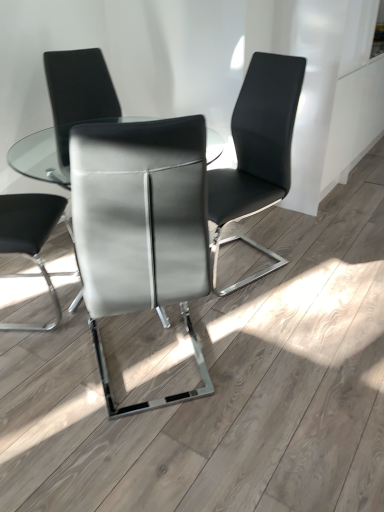
Identify the location of matte black chair at center, placed as the 3th chair when sorted from left to right. (257, 152).

The height and width of the screenshot is (512, 384). What do you see at coordinates (257, 152) in the screenshot?
I see `matte black chair at center, marked as the 1th chair in a right-to-left arrangement` at bounding box center [257, 152].

Identify the location of clear glass table at center. (40, 156).

Is satin gray leather chair at center, marked as the second chair in a right-to-left arrangement, touching matte black chair at center, placed as the 3th chair when sorted from left to right?

No, satin gray leather chair at center, marked as the second chair in a right-to-left arrangement, is not in contact with matte black chair at center, placed as the 3th chair when sorted from left to right.

How many degrees apart are the facing directions of satin gray leather chair at center, marked as the second chair in a right-to-left arrangement, and matte black chair at center, placed as the 3th chair when sorted from left to right?

The angle between the facing direction of satin gray leather chair at center, marked as the second chair in a right-to-left arrangement, and the facing direction of matte black chair at center, placed as the 3th chair when sorted from left to right, is 113 degrees.

Considering the sizes of objects satin gray leather chair at center, marked as the second chair in a right-to-left arrangement, and matte black chair at center, marked as the 1th chair in a right-to-left arrangement, in the image provided, who is wider, satin gray leather chair at center, marked as the second chair in a right-to-left arrangement, or matte black chair at center, marked as the 1th chair in a right-to-left arrangement,?

satin gray leather chair at center, marked as the second chair in a right-to-left arrangement.

Who is more distant, satin gray leather chair at center, placed as the 2th chair when sorted from left to right, or matte black chair at center, marked as the 1th chair in a right-to-left arrangement?

matte black chair at center, marked as the 1th chair in a right-to-left arrangement.

Looking at this image, from a real-world perspective, is matte black chair at center, placed as the 3th chair when sorted from left to right, positioned above or below satin gray leather chair at center, placed as the 2th chair when sorted from left to right?

In terms of real-world spatial position, matte black chair at center, placed as the 3th chair when sorted from left to right, is below satin gray leather chair at center, placed as the 2th chair when sorted from left to right.

From the image's perspective, which is below, matte black chair at center, marked as the 1th chair in a right-to-left arrangement, or satin gray leather chair at center, placed as the 2th chair when sorted from left to right?

satin gray leather chair at center, placed as the 2th chair when sorted from left to right, from the image's perspective.

Find the location of `chair that is below the matte black chair at center, placed as the 3th chair when sorted from left to right (from the image's perspective)`. chair that is below the matte black chair at center, placed as the 3th chair when sorted from left to right (from the image's perspective) is located at coordinates (141, 226).

Is satin gray leather chair at center, placed as the 2th chair when sorted from left to right, at the back of matte black chair at center, placed as the 3th chair when sorted from left to right?

matte black chair at center, placed as the 3th chair when sorted from left to right, is not turned away from satin gray leather chair at center, placed as the 2th chair when sorted from left to right.

The height and width of the screenshot is (512, 384). What are the coordinates of `table in front of the sleek leather chair at center, which is the third chair from right to left` in the screenshot? It's located at (40, 156).

Is sleek leather chair at center, which is the third chair from right to left, positioned in front of clear glass table at center?

No, sleek leather chair at center, which is the third chair from right to left, is further to the viewer.

Based on the photo, from their relative heights in the image, would you say sleek leather chair at center, placed as the first chair when sorted from left to right, is taller or shorter than clear glass table at center?

Considering their sizes, sleek leather chair at center, placed as the first chair when sorted from left to right, has more height than clear glass table at center.

From the picture: Is satin gray leather chair at center, placed as the 2th chair when sorted from left to right, to the left or to the right of sleek leather chair at center, which is the third chair from right to left, in the image?

Based on their positions, satin gray leather chair at center, placed as the 2th chair when sorted from left to right, is located to the right of sleek leather chair at center, which is the third chair from right to left.

Would you say satin gray leather chair at center, marked as the second chair in a right-to-left arrangement, is a long distance from sleek leather chair at center, placed as the first chair when sorted from left to right?

satin gray leather chair at center, marked as the second chair in a right-to-left arrangement, is positioned a significant distance from sleek leather chair at center, placed as the first chair when sorted from left to right.

Do you think satin gray leather chair at center, marked as the second chair in a right-to-left arrangement, is within sleek leather chair at center, placed as the first chair when sorted from left to right, or outside of it?

satin gray leather chair at center, marked as the second chair in a right-to-left arrangement, is not inside sleek leather chair at center, placed as the first chair when sorted from left to right, it's outside.

Considering the relative sizes of clear glass table at center and sleek leather chair at center, placed as the first chair when sorted from left to right, in the image provided, is clear glass table at center taller than sleek leather chair at center, placed as the first chair when sorted from left to right,?

Incorrect, the height of clear glass table at center is not larger of that of sleek leather chair at center, placed as the first chair when sorted from left to right.

From the image's perspective, is clear glass table at center under sleek leather chair at center, which is the third chair from right to left?

Yes.

Does clear glass table at center appear on the right side of sleek leather chair at center, which is the third chair from right to left?

Yes, clear glass table at center is to the right of sleek leather chair at center, which is the third chair from right to left.

Is clear glass table at center looking in the opposite direction of sleek leather chair at center, placed as the first chair when sorted from left to right?

Yes, sleek leather chair at center, placed as the first chair when sorted from left to right, is at the back of clear glass table at center.

Is matte black chair at center, marked as the 1th chair in a right-to-left arrangement, next to sleek leather chair at center, which is the third chair from right to left, and touching it?

matte black chair at center, marked as the 1th chair in a right-to-left arrangement, is not next to sleek leather chair at center, which is the third chair from right to left, and they're not touching.

Consider the image. From the image's perspective, which one is positioned lower, matte black chair at center, placed as the 3th chair when sorted from left to right, or sleek leather chair at center, placed as the first chair when sorted from left to right?

matte black chair at center, placed as the 3th chair when sorted from left to right.

From a real-world perspective, which object rests below the other?

In real-world perspective, matte black chair at center, placed as the 3th chair when sorted from left to right, is lower.

Who is smaller, matte black chair at center, placed as the 3th chair when sorted from left to right, or sleek leather chair at center, placed as the first chair when sorted from left to right?

sleek leather chair at center, placed as the first chair when sorted from left to right, is smaller.

From the image's perspective, relative to satin gray leather chair at center, marked as the second chair in a right-to-left arrangement, is clear glass table at center above or below?

From the image's perspective, clear glass table at center appears above satin gray leather chair at center, marked as the second chair in a right-to-left arrangement.

Is clear glass table at center next to satin gray leather chair at center, marked as the second chair in a right-to-left arrangement?

No, clear glass table at center is not with satin gray leather chair at center, marked as the second chair in a right-to-left arrangement.

Considering the points (61, 176) and (131, 172), which point is in front, point (61, 176) or point (131, 172)?

The point (131, 172) is in front.

Which object is wider, clear glass table at center or satin gray leather chair at center, placed as the 2th chair when sorted from left to right?

With larger width is clear glass table at center.

Where is `chair that is on the right side of satin gray leather chair at center, placed as the 2th chair when sorted from left to right`? The height and width of the screenshot is (512, 384). chair that is on the right side of satin gray leather chair at center, placed as the 2th chair when sorted from left to right is located at coordinates (257, 152).

This screenshot has height=512, width=384. What are the coordinates of `chair beneath the satin gray leather chair at center, placed as the 2th chair when sorted from left to right (from a real-world perspective)` in the screenshot? It's located at (257, 152).

From the image, which object appears to be nearer to matte black chair at center, marked as the 1th chair in a right-to-left arrangement, satin gray leather chair at center, placed as the 2th chair when sorted from left to right, or clear glass table at center?

satin gray leather chair at center, placed as the 2th chair when sorted from left to right, is positioned closer to the anchor matte black chair at center, marked as the 1th chair in a right-to-left arrangement.

Based on their spatial positions, is satin gray leather chair at center, placed as the 2th chair when sorted from left to right, or matte black chair at center, marked as the 1th chair in a right-to-left arrangement, closer to sleek leather chair at center, which is the third chair from right to left?

Among the two, matte black chair at center, marked as the 1th chair in a right-to-left arrangement, is located nearer to sleek leather chair at center, which is the third chair from right to left.

Considering their positions, is matte black chair at center, placed as the 3th chair when sorted from left to right, positioned further to satin gray leather chair at center, placed as the 2th chair when sorted from left to right, than clear glass table at center?

clear glass table at center is positioned further to the anchor satin gray leather chair at center, placed as the 2th chair when sorted from left to right.

When comparing their distances from sleek leather chair at center, placed as the first chair when sorted from left to right, does clear glass table at center or satin gray leather chair at center, marked as the second chair in a right-to-left arrangement, seem closer?

Based on the image, clear glass table at center appears to be nearer to sleek leather chair at center, placed as the first chair when sorted from left to right.

From the image, which object appears to be nearer to clear glass table at center, sleek leather chair at center, which is the third chair from right to left, or satin gray leather chair at center, placed as the 2th chair when sorted from left to right?

sleek leather chair at center, which is the third chair from right to left, lies closer to clear glass table at center than the other object.

Which object lies further to the anchor point sleek leather chair at center, placed as the first chair when sorted from left to right, satin gray leather chair at center, placed as the 2th chair when sorted from left to right, or clear glass table at center?

Among the two, satin gray leather chair at center, placed as the 2th chair when sorted from left to right, is located further to sleek leather chair at center, placed as the first chair when sorted from left to right.

Considering their positions, is matte black chair at center, marked as the 1th chair in a right-to-left arrangement, positioned closer to clear glass table at center than sleek leather chair at center, placed as the first chair when sorted from left to right?

sleek leather chair at center, placed as the first chair when sorted from left to right, is positioned closer to the anchor clear glass table at center.

When comparing their distances from sleek leather chair at center, which is the third chair from right to left, does clear glass table at center or matte black chair at center, marked as the 1th chair in a right-to-left arrangement, seem further?

matte black chair at center, marked as the 1th chair in a right-to-left arrangement, lies further to sleek leather chair at center, which is the third chair from right to left, than the other object.

At what (x,y) coordinates should I click in order to perform the action: click on table situated between sleek leather chair at center, placed as the first chair when sorted from left to right, and matte black chair at center, marked as the 1th chair in a right-to-left arrangement, from left to right. Please return your answer as a coordinate pair (x, y). Looking at the image, I should click on point(40,156).

Locate an element on the screen. Image resolution: width=384 pixels, height=512 pixels. table between satin gray leather chair at center, placed as the 2th chair when sorted from left to right, and sleek leather chair at center, placed as the first chair when sorted from left to right, along the z-axis is located at coordinates (40, 156).

At what (x,y) coordinates should I click in order to perform the action: click on table between satin gray leather chair at center, marked as the second chair in a right-to-left arrangement, and matte black chair at center, placed as the 3th chair when sorted from left to right, in the front-back direction. Please return your answer as a coordinate pair (x, y). This screenshot has height=512, width=384. Looking at the image, I should click on (40, 156).

The width and height of the screenshot is (384, 512). I want to click on chair between satin gray leather chair at center, marked as the second chair in a right-to-left arrangement, and sleek leather chair at center, which is the third chair from right to left, along the z-axis, so point(257,152).